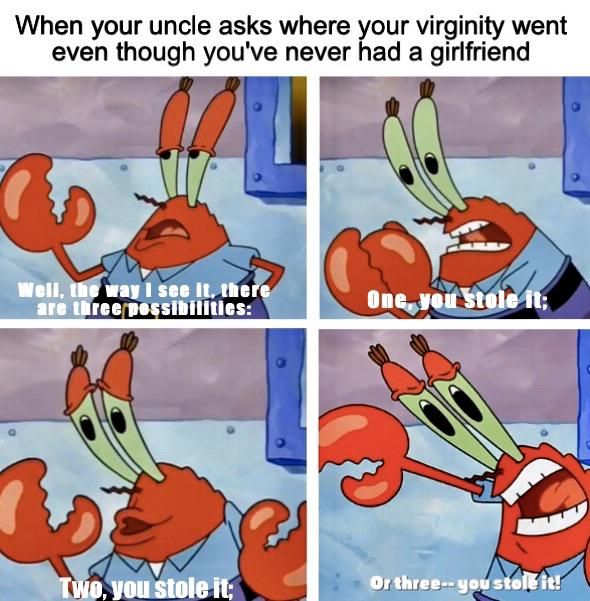
Where is `floor`? The image size is (590, 601). floor is located at coordinates (444, 520), (205, 440), (114, 210), (508, 187).